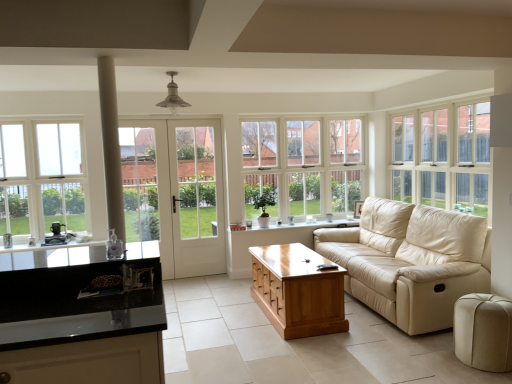
Question: Considering the relative sizes of white wood window at upper right, arranged as the third window when viewed from the left, and black glossy countertop at lower left in the image provided, is white wood window at upper right, arranged as the third window when viewed from the left, shorter than black glossy countertop at lower left?

Choices:
 (A) no
 (B) yes

Answer: (A)

Question: From a real-world perspective, is white wood window at upper right, arranged as the third window when viewed from the left, physically below black glossy countertop at lower left?

Choices:
 (A) no
 (B) yes

Answer: (A)

Question: Is white wood window at upper right, acting as the 1th window starting from the right, not near black glossy countertop at lower left?

Choices:
 (A) yes
 (B) no

Answer: (A)

Question: Is white wood window at upper right, arranged as the third window when viewed from the left, in contact with black glossy countertop at lower left?

Choices:
 (A) no
 (B) yes

Answer: (A)

Question: Considering the relative sizes of white wood window at upper right, arranged as the third window when viewed from the left, and black glossy countertop at lower left in the image provided, is white wood window at upper right, arranged as the third window when viewed from the left, thinner than black glossy countertop at lower left?

Choices:
 (A) no
 (B) yes

Answer: (B)

Question: From a real-world perspective, is white wood window at center, which is the second window from left to right, above or below shiny brown wooden coffee table at center?

Choices:
 (A) above
 (B) below

Answer: (A)

Question: Is white wood window at center, placed as the 2th window when sorted from right to left, inside or outside of shiny brown wooden coffee table at center?

Choices:
 (A) outside
 (B) inside

Answer: (A)

Question: Is white wood window at center, which is the second window from left to right, to the left or to the right of shiny brown wooden coffee table at center in the image?

Choices:
 (A) right
 (B) left

Answer: (A)

Question: Does point (311, 150) appear closer or farther from the camera than point (278, 292)?

Choices:
 (A) farther
 (B) closer

Answer: (A)

Question: Considering the positions of beige leather couch at center and white wood window at center, placed as the 2th window when sorted from right to left, in the image, is beige leather couch at center wider or thinner than white wood window at center, placed as the 2th window when sorted from right to left,?

Choices:
 (A) wide
 (B) thin

Answer: (A)

Question: From a real-world perspective, is beige leather couch at center above or below white wood window at center, which is the second window from left to right?

Choices:
 (A) above
 (B) below

Answer: (B)

Question: Is point (439, 284) positioned closer to the camera than point (346, 137)?

Choices:
 (A) farther
 (B) closer

Answer: (B)

Question: Is beige leather couch at center taller or shorter than white wood window at center, which is the second window from left to right?

Choices:
 (A) tall
 (B) short

Answer: (B)

Question: From a real-world perspective, is beige velvet ottoman at lower right positioned above or below shiny brown wooden coffee table at center?

Choices:
 (A) above
 (B) below

Answer: (B)

Question: Considering the positions of beige velvet ottoman at lower right and shiny brown wooden coffee table at center in the image, is beige velvet ottoman at lower right bigger or smaller than shiny brown wooden coffee table at center?

Choices:
 (A) big
 (B) small

Answer: (B)